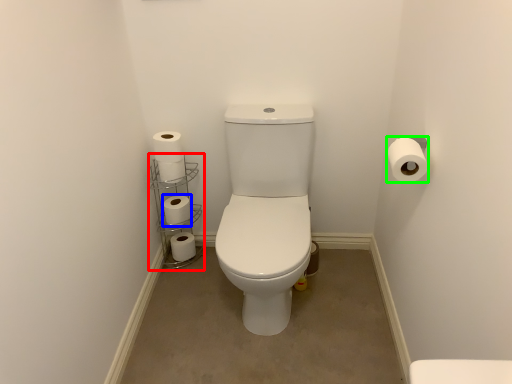
Question: Which is nearer to the shelf (highlighted by a red box)? toilet paper (highlighted by a blue box) or toilet paper (highlighted by a green box).

Choices:
 (A) toilet paper
 (B) toilet paper

Answer: (A)